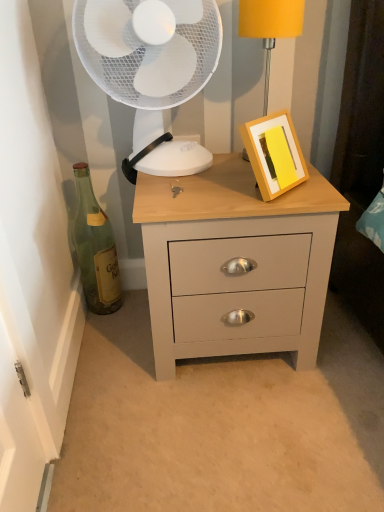
At what (x,y) coordinates should I click in order to perform the action: click on free space on the front side of green glass bottle at left. Please return your answer as a coordinate pair (x, y). The width and height of the screenshot is (384, 512). Looking at the image, I should click on (108, 341).